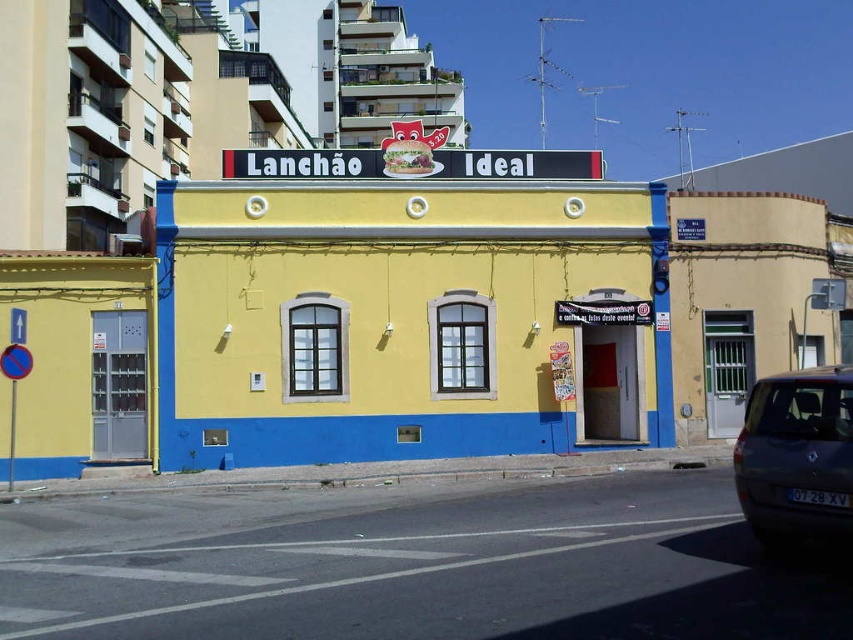
You are a delivery person trying to park your motorcycle in front of the yellow matte building at center. The motorcycle requires a space that is at least as wide as the yellow matte door at lower left. Is there enough space available?

The yellow matte building at center is wider than the yellow matte door at lower left, so there should be sufficient space to park the motorcycle in front of it.

You are a delivery person with a 3.5 meter long ladder. You need to place the ladder from the yellow matte building at center to the yellow matte door at lower left. Will the ladder be long enough?

The yellow matte building at center and yellow matte door at lower left are 3.23 meters apart from each other. The ladder is 3.5 meters long, so it will be long enough to reach between them.

You are a delivery person who needs to park your dark gray metallic car at lower right near the yellow matte door at lower left. Considering their sizes, will the car fit in the space next to the door without any adjustments?

The yellow matte door at lower left is much taller than the dark gray metallic car at lower right. Since the car is shorter in height, it should fit in the space next to the door without requiring adjustments.